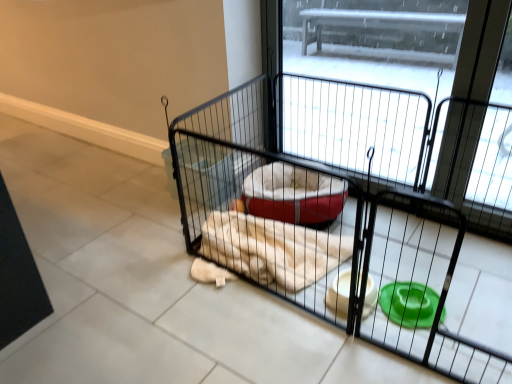
Locate an element on the screen. This screenshot has height=384, width=512. vacant space underneath black wire cage at center (from a real-world perspective) is located at coordinates (358, 294).